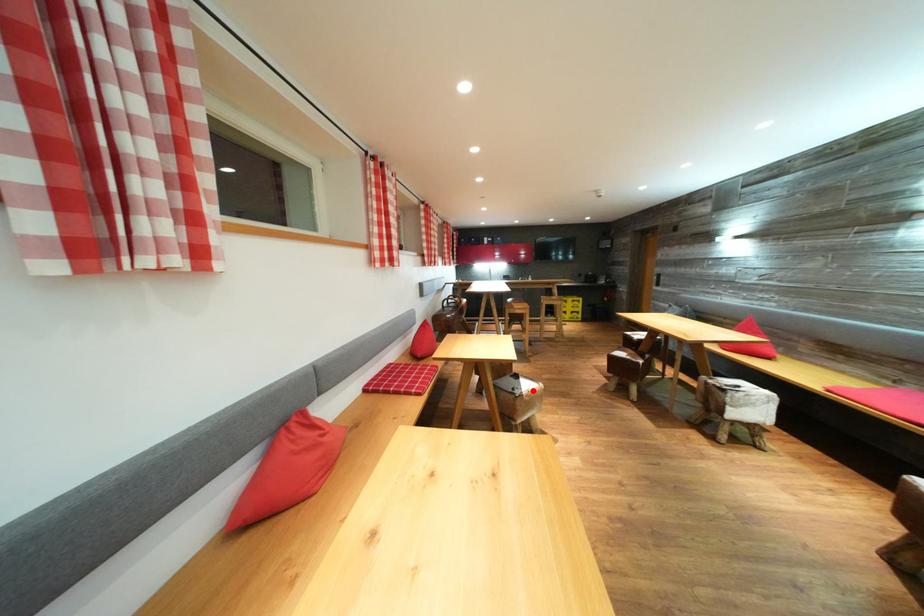
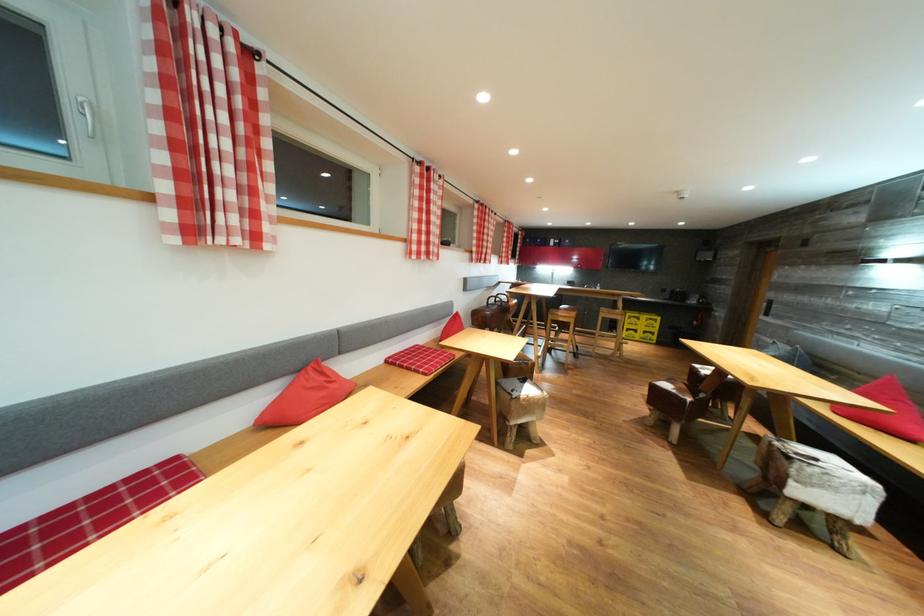
Locate, in the second image, the point that corresponds to the highlighted location in the first image.

(536, 395)